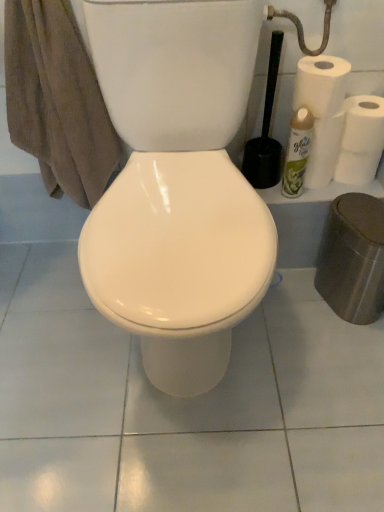
Question: Could white matte toilet paper at right be considered to be inside brown cotton towel at left?

Choices:
 (A) yes
 (B) no

Answer: (B)

Question: Is brown cotton towel at left oriented away from white matte toilet paper at right?

Choices:
 (A) yes
 (B) no

Answer: (B)

Question: From the image's perspective, is brown cotton towel at left located above white matte toilet paper at right?

Choices:
 (A) no
 (B) yes

Answer: (A)

Question: Is brown cotton towel at left far away from white matte toilet paper at right?

Choices:
 (A) no
 (B) yes

Answer: (A)

Question: Can you see brown cotton towel at left touching white matte toilet paper at right?

Choices:
 (A) no
 (B) yes

Answer: (A)

Question: From a real-world perspective, is brown cotton towel at left physically below white matte toilet paper at right?

Choices:
 (A) no
 (B) yes

Answer: (A)

Question: Is green matte air freshener at right to the right of white matte toilet paper at right from the viewer's perspective?

Choices:
 (A) no
 (B) yes

Answer: (A)

Question: From a real-world perspective, does green matte air freshener at right sit lower than white matte toilet paper at right?

Choices:
 (A) yes
 (B) no

Answer: (A)

Question: Is white matte toilet paper at right surrounded by green matte air freshener at right?

Choices:
 (A) yes
 (B) no

Answer: (B)

Question: Is green matte air freshener at right not near white matte toilet paper at right?

Choices:
 (A) yes
 (B) no

Answer: (B)

Question: Does green matte air freshener at right come behind white matte toilet paper at right?

Choices:
 (A) no
 (B) yes

Answer: (A)

Question: Considering the relative sizes of green matte air freshener at right and white matte toilet paper at right in the image provided, is green matte air freshener at right thinner than white matte toilet paper at right?

Choices:
 (A) yes
 (B) no

Answer: (A)

Question: Is the position of brown cotton towel at left less distant than that of black plastic toilet brush at right?

Choices:
 (A) yes
 (B) no

Answer: (A)